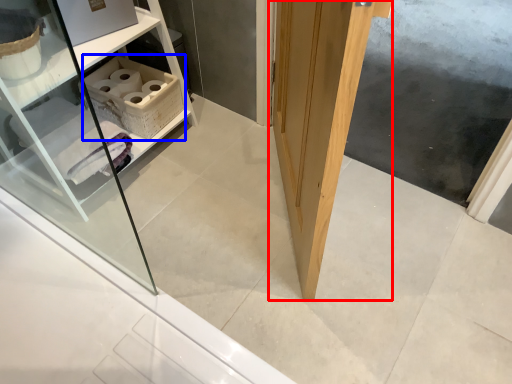
Question: Which point is further to the camera, door (highlighted by a red box) or cabinetry (highlighted by a blue box)?

Choices:
 (A) door
 (B) cabinetry

Answer: (B)